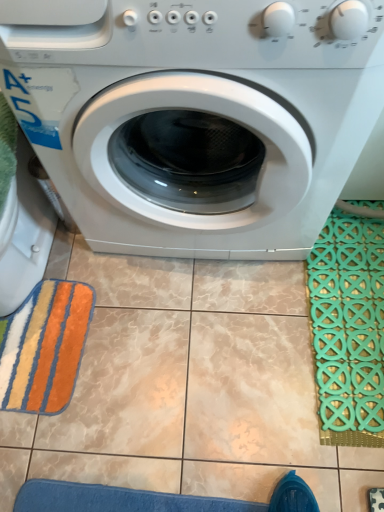
Measure the distance between white glossy washing machine at center and camera.

white glossy washing machine at center and camera are 19.15 inches apart.

Find the location of a particular element. Image resolution: width=384 pixels, height=512 pixels. green rubber bath mat at right is located at coordinates (348, 329).

Considering the relative sizes of green rubber bath mat at right and multicolored plush bath towel at lower left in the image provided, is green rubber bath mat at right wider than multicolored plush bath towel at lower left?

No.

Consider the image. Which is behind, green rubber bath mat at right or multicolored plush bath towel at lower left?

multicolored plush bath towel at lower left is further from the camera.

Is green rubber bath mat at right aimed at multicolored plush bath towel at lower left?

Yes.

Is green rubber bath mat at right positioned beyond the bounds of multicolored plush bath towel at lower left?

green rubber bath mat at right is positioned outside multicolored plush bath towel at lower left.

Who is more distant, green rubber bath mat at right or white glossy washing machine at center?

green rubber bath mat at right is behind.

Considering the sizes of green rubber bath mat at right and white glossy washing machine at center in the image, is green rubber bath mat at right wider or thinner than white glossy washing machine at center?

Clearly, green rubber bath mat at right has less width compared to white glossy washing machine at center.

From their relative heights in the image, would you say green rubber bath mat at right is taller or shorter than white glossy washing machine at center?

Clearly, green rubber bath mat at right is shorter compared to white glossy washing machine at center.

From the image's perspective, which is above, green rubber bath mat at right or white glossy washing machine at center?

white glossy washing machine at center, from the image's perspective.

Looking at this image, from a real-world perspective, relative to multicolored plush bath towel at lower left, is white glossy washing machine at center vertically above or below?

In terms of real-world spatial position, white glossy washing machine at center is above multicolored plush bath towel at lower left.

Considering the sizes of objects white glossy washing machine at center and multicolored plush bath towel at lower left in the image provided, who is shorter, white glossy washing machine at center or multicolored plush bath towel at lower left?

multicolored plush bath towel at lower left is shorter.

Where is `bath mat located underneath the white glossy washing machine at center (from a real-world perspective)`? bath mat located underneath the white glossy washing machine at center (from a real-world perspective) is located at coordinates (348, 329).

Does point (356, 64) lie behind point (308, 284)?

No, (356, 64) is in front of (308, 284).

Is white glossy washing machine at center positioned far away from green rubber bath mat at right?

They are positioned close to each other.

Is white glossy washing machine at center thinner than green rubber bath mat at right?

No, white glossy washing machine at center is not thinner than green rubber bath mat at right.

Is point (28, 407) positioned behind point (319, 414)?

Yes.

Is green rubber bath mat at right at the back of multicolored plush bath towel at lower left?

No, green rubber bath mat at right is not at the back of multicolored plush bath towel at lower left.

From the picture: Is multicolored plush bath towel at lower left not near green rubber bath mat at right?

No, multicolored plush bath towel at lower left is not far away from green rubber bath mat at right.

Considering the relative positions of multicolored plush bath towel at lower left and green rubber bath mat at right in the image provided, is multicolored plush bath towel at lower left to the left of green rubber bath mat at right from the viewer's perspective?

Yes.

Consider the image. Which is more to the right, multicolored plush bath towel at lower left or white glossy washing machine at center?

white glossy washing machine at center is more to the right.

Does multicolored plush bath towel at lower left turn towards white glossy washing machine at center?

No, multicolored plush bath towel at lower left does not turn towards white glossy washing machine at center.

I want to click on bath towel on the left of white glossy washing machine at center, so click(44, 347).

Is white glossy washing machine at center located within multicolored plush bath towel at lower left?

A: No, white glossy washing machine at center is not inside multicolored plush bath towel at lower left.

You are a GUI agent. You are given a task and a screenshot of the screen. Output one action in this format:
    pyautogui.click(x=<x>, y=<y>)
    Task: Click on the bath mat that appears on the right of multicolored plush bath towel at lower left
    
    Given the screenshot: What is the action you would take?
    pyautogui.click(x=348, y=329)

This screenshot has width=384, height=512. In order to click on washing machine on the left of the green rubber bath mat at right in this screenshot , I will do `click(196, 115)`.

When comparing their distances from multicolored plush bath towel at lower left, does white glossy washing machine at center or green rubber bath mat at right seem closer?

white glossy washing machine at center is closer to multicolored plush bath towel at lower left.

Looking at this image, from the image, which object appears to be nearer to green rubber bath mat at right, white glossy washing machine at center or multicolored plush bath towel at lower left?

white glossy washing machine at center is positioned closer to the anchor green rubber bath mat at right.

Based on their spatial positions, is multicolored plush bath towel at lower left or green rubber bath mat at right closer to white glossy washing machine at center?

Based on the image, green rubber bath mat at right appears to be nearer to white glossy washing machine at center.

Looking at the image, which one is located further to white glossy washing machine at center, green rubber bath mat at right or multicolored plush bath towel at lower left?

multicolored plush bath towel at lower left.

Which object lies nearer to the anchor point green rubber bath mat at right, multicolored plush bath towel at lower left or white glossy washing machine at center?

white glossy washing machine at center is positioned closer to the anchor green rubber bath mat at right.

Based on their spatial positions, is green rubber bath mat at right or white glossy washing machine at center closer to multicolored plush bath towel at lower left?

Based on the image, white glossy washing machine at center appears to be nearer to multicolored plush bath towel at lower left.

Locate an element on the screen. The width and height of the screenshot is (384, 512). washing machine located between multicolored plush bath towel at lower left and green rubber bath mat at right in the left-right direction is located at coordinates (196, 115).